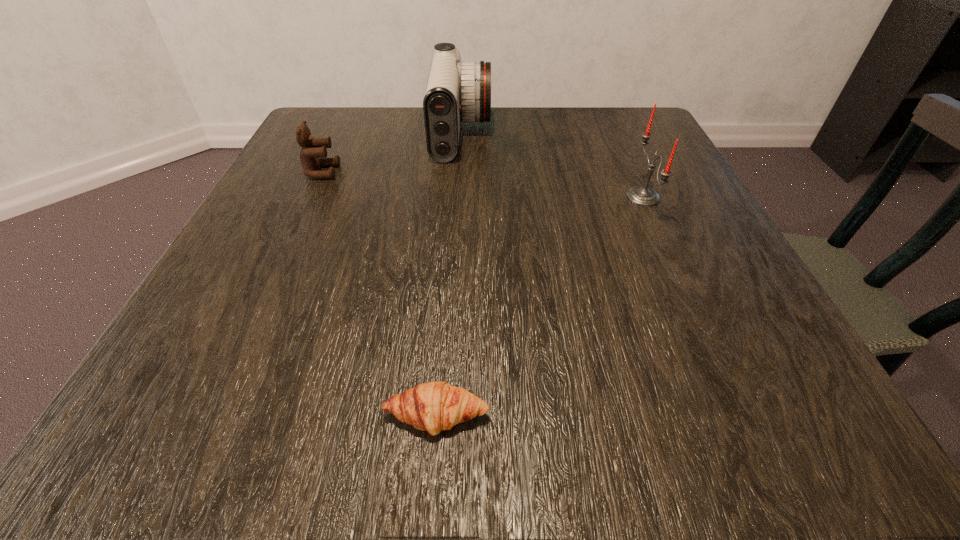
This screenshot has height=540, width=960. Find the location of `free space at the far right corner of the desktop`. free space at the far right corner of the desktop is located at coordinates (625, 128).

I want to click on vacant space in between the camcorder and the nearest object, so click(x=449, y=275).

In order to click on unoccupied position between the shortest object and the candle in this screenshot , I will do `click(540, 307)`.

The width and height of the screenshot is (960, 540). Identify the location of free space between the teddy bear and the camcorder. (392, 153).

In order to click on vacant region between the camcorder and the nearest object in this screenshot , I will do `click(449, 275)`.

Locate an element on the screen. The width and height of the screenshot is (960, 540). vacant point located between the candle and the teddy bear is located at coordinates (482, 185).

I want to click on vacant area between the pastry and the camcorder, so click(449, 275).

Image resolution: width=960 pixels, height=540 pixels. What are the coordinates of `empty space that is in between the shortest object and the candle` in the screenshot? It's located at (540, 307).

The width and height of the screenshot is (960, 540). What are the coordinates of `free point between the rightmost object and the leftmost object` in the screenshot? It's located at (482, 185).

Find the location of a particular element. blank region between the pastry and the candle is located at coordinates (540, 307).